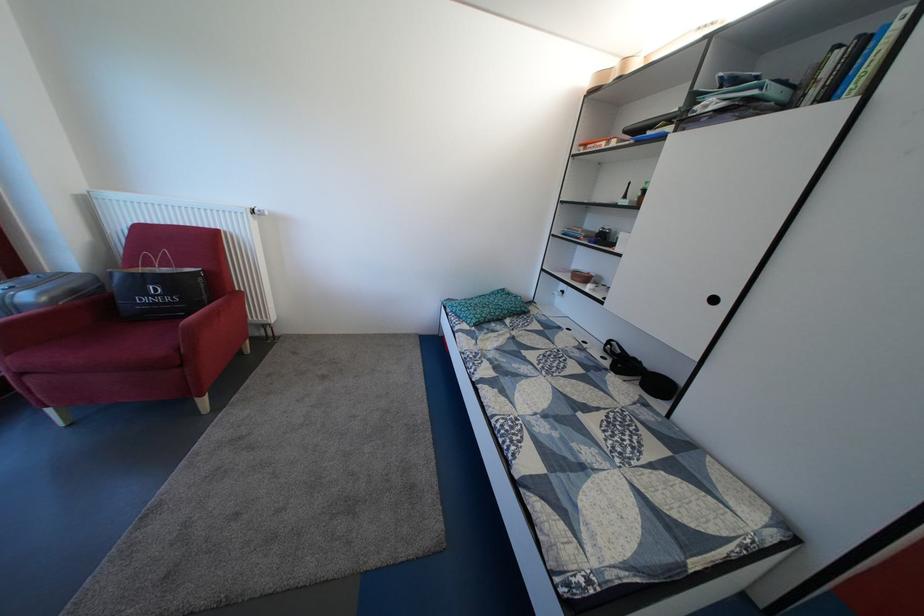
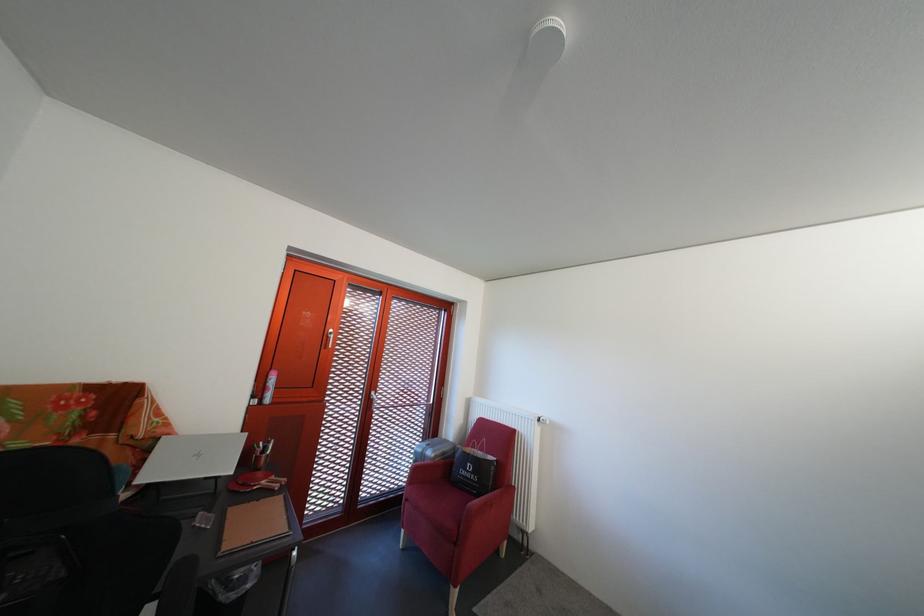
Find the pixel in the second image that matches pixel 32 381 in the first image.

(418, 507)